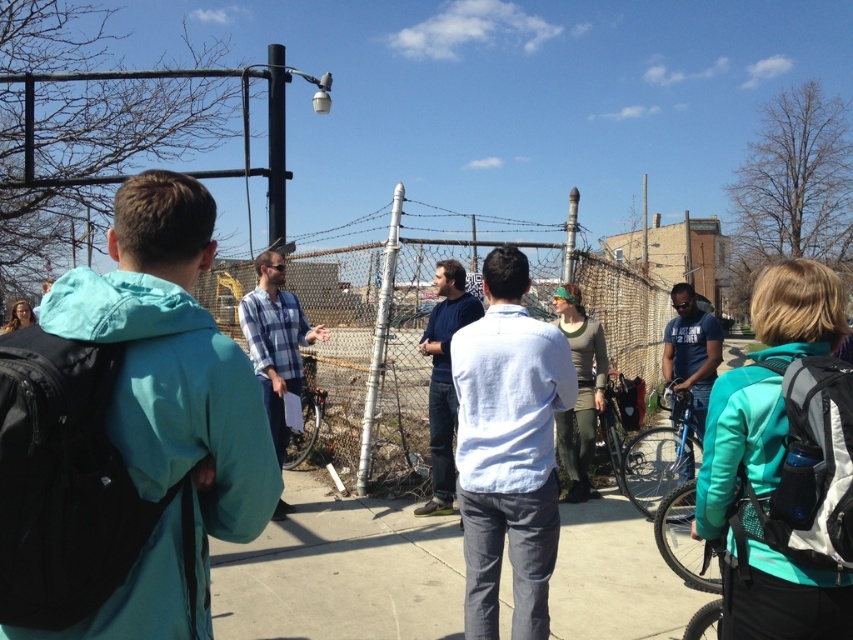
You are standing at the origin point in the image and want to locate the white cotton shirt at center. Which direction should you move to find it?

The white cotton shirt at center is located at the point with coordinates 0.703 in the x direction and 0.597 in the y direction. Since the origin is at the bottom left corner of the image, you should move to the right and slightly upwards to reach the white cotton shirt at center.